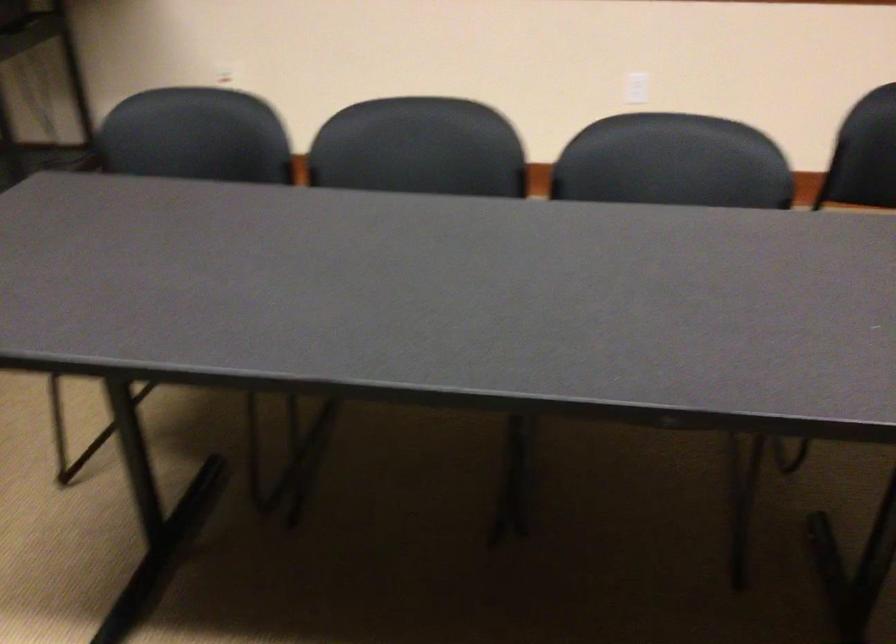
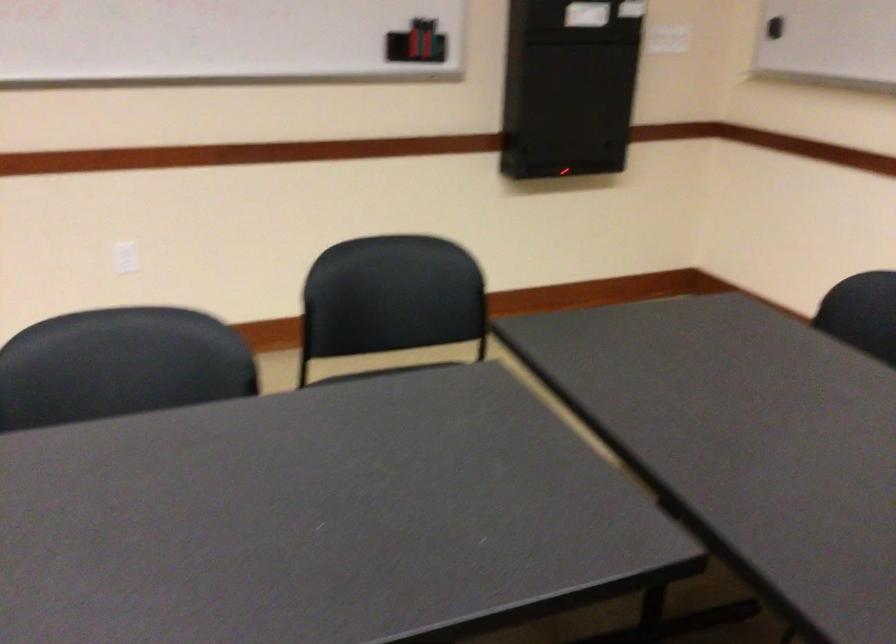
Where in the second image is the point corresponding to [642,88] from the first image?

(125, 257)